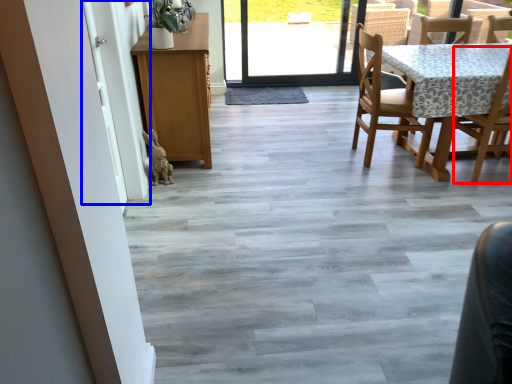
Question: Among these objects, which one is farthest to the camera, chair (highlighted by a red box) or screen door (highlighted by a blue box)?

Choices:
 (A) chair
 (B) screen door

Answer: (A)